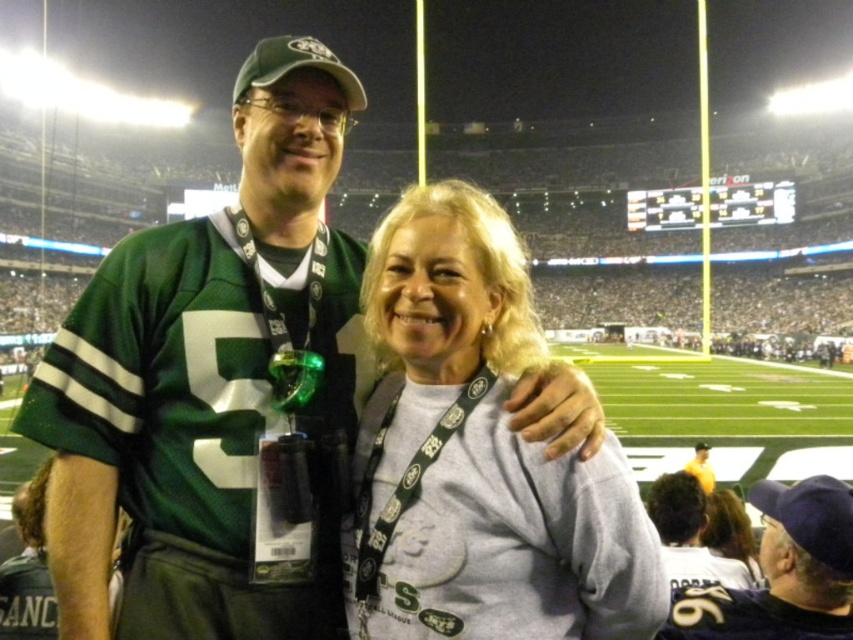
Does matte green jersey at center appear on the right side of yellow jersey at center?

No, matte green jersey at center is not to the right of yellow jersey at center.

Who is positioned more to the right, matte green jersey at center or yellow jersey at center?

From the viewer's perspective, yellow jersey at center appears more on the right side.

Does point (788, 561) lie in front of point (701, 465)?

Yes, it is in front of point (701, 465).

Where is `matte green jersey at center`? matte green jersey at center is located at coordinates (782, 572).

Which is above, white jersey at center or yellow jersey at center?

yellow jersey at center is higher up.

Which is in front, point (709, 563) or point (689, 461)?

Point (709, 563)

I want to click on white jersey at center, so click(x=689, y=536).

Is gray cotton sweatshirt at center above light brown hair at lower right?

Correct, gray cotton sweatshirt at center is located above light brown hair at lower right.

Is gray cotton sweatshirt at center smaller than light brown hair at lower right?

Actually, gray cotton sweatshirt at center might be larger than light brown hair at lower right.

From the picture: Measure the distance between gray cotton sweatshirt at center and camera.

A distance of 90.36 feet exists between gray cotton sweatshirt at center and camera.

Identify the location of gray cotton sweatshirt at center. (479, 456).